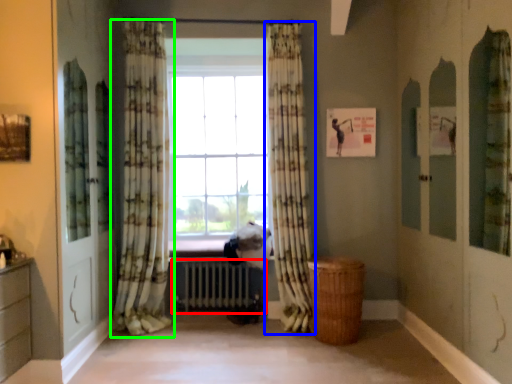
Question: Which is nearer to the radiator (highlighted by a red box)? curtain (highlighted by a blue box) or curtain (highlighted by a green box).

Choices:
 (A) curtain
 (B) curtain

Answer: (B)